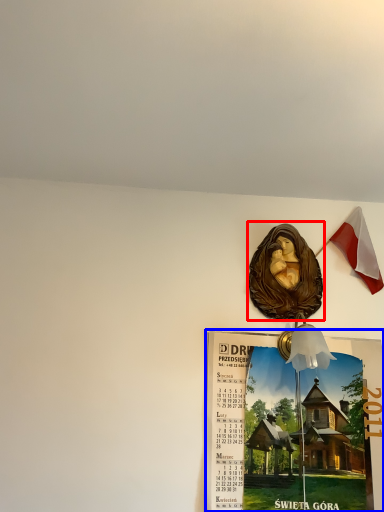
Question: Among these objects, which one is nearest to the camera, art (highlighted by a red box) or poster page (highlighted by a blue box)?

Choices:
 (A) art
 (B) poster page

Answer: (B)